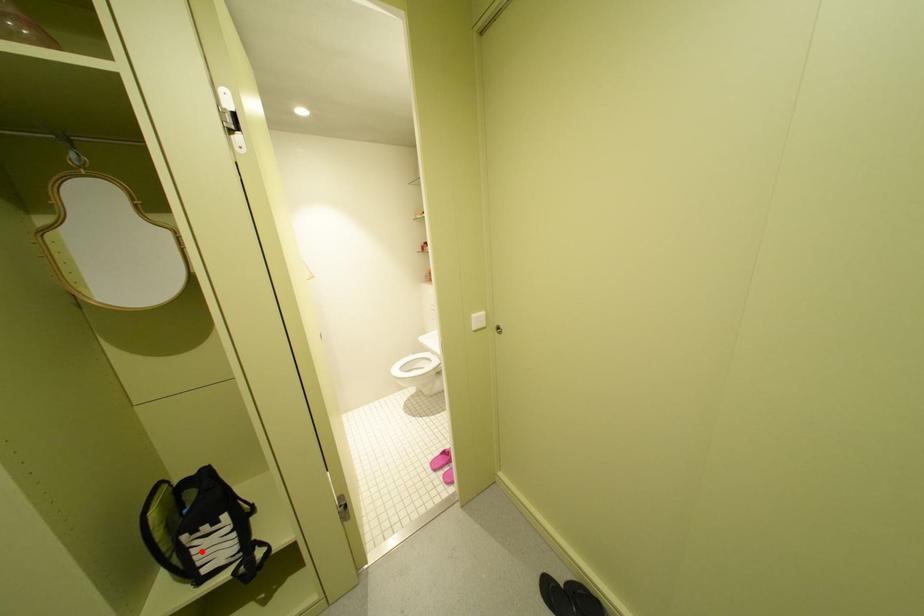
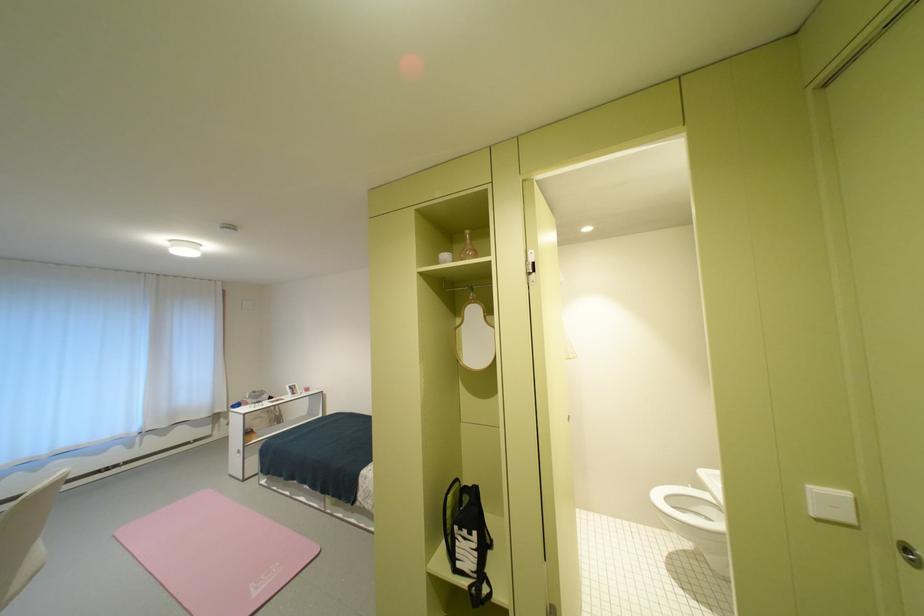
Question: I am providing you with two images of the same scene from different viewpoints. A red point is marked on the first image. At the location where the point appears in image 1, is it still visible in image 2?

Choices:
 (A) Yes
 (B) No

Answer: (A)